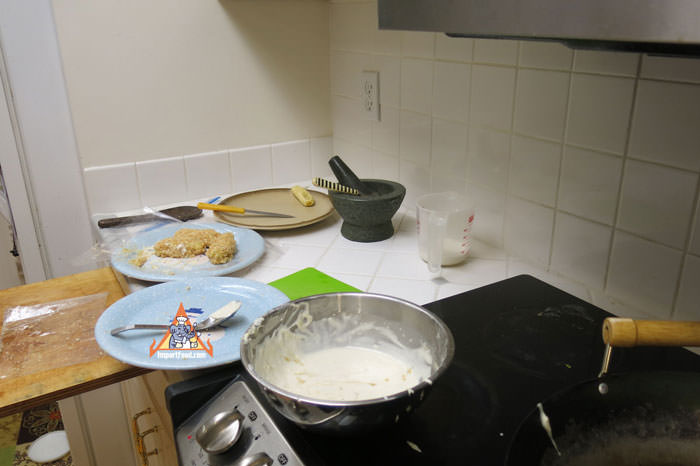
Locate an element on the screen. label on the cup is located at coordinates (469, 220).